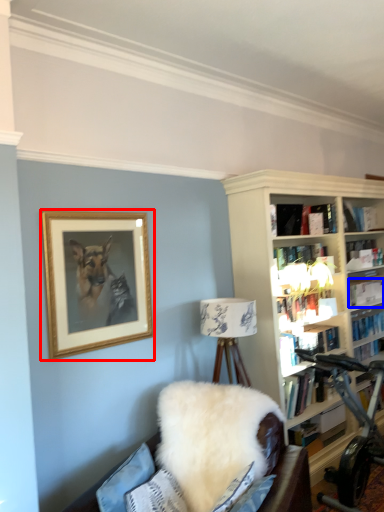
Question: Which of the following is the farthest to the observer, picture frame (highlighted by a red box) or book (highlighted by a blue box)?

Choices:
 (A) picture frame
 (B) book

Answer: (B)